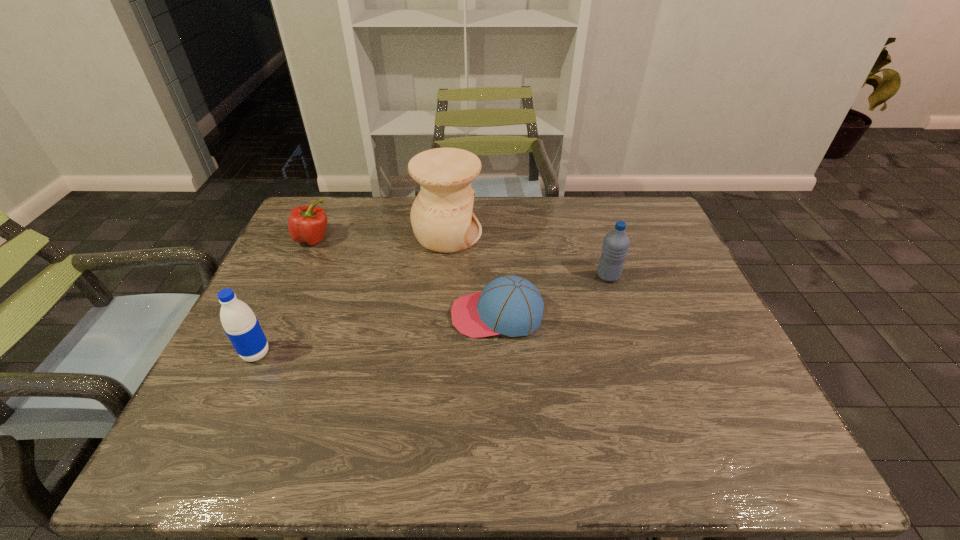
Where is `pottery`? pottery is located at coordinates (442, 218).

Locate an element on the screen. the left water bottle is located at coordinates (238, 320).

Identify the location of the nearest object. The image size is (960, 540). (238, 320).

The width and height of the screenshot is (960, 540). In order to click on the third nearest object in this screenshot , I will do `click(616, 243)`.

Find the location of a particular element. the rightmost object is located at coordinates (616, 243).

Where is `bell pepper`? The height and width of the screenshot is (540, 960). bell pepper is located at coordinates point(307,224).

The image size is (960, 540). Identify the location of the fourth farthest object. tap(510, 305).

The image size is (960, 540). Identify the location of vacant point located at the open side of the tallest object. (537, 234).

Locate an element on the screen. This screenshot has width=960, height=540. vacant region located 0.200m on the back of the left water bottle is located at coordinates (288, 285).

Locate an element on the screen. vacant space situated 0.280m on the left of the rightmost object is located at coordinates (495, 276).